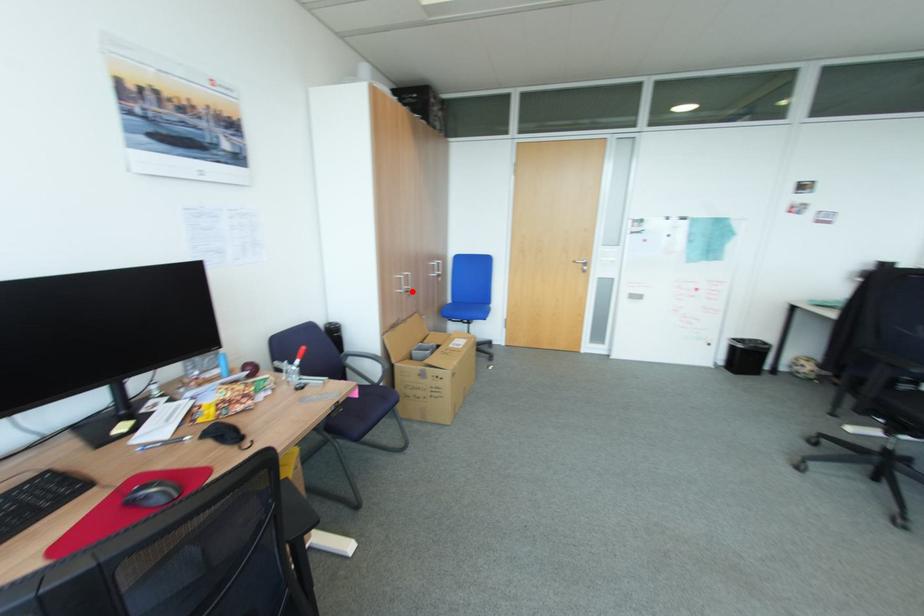
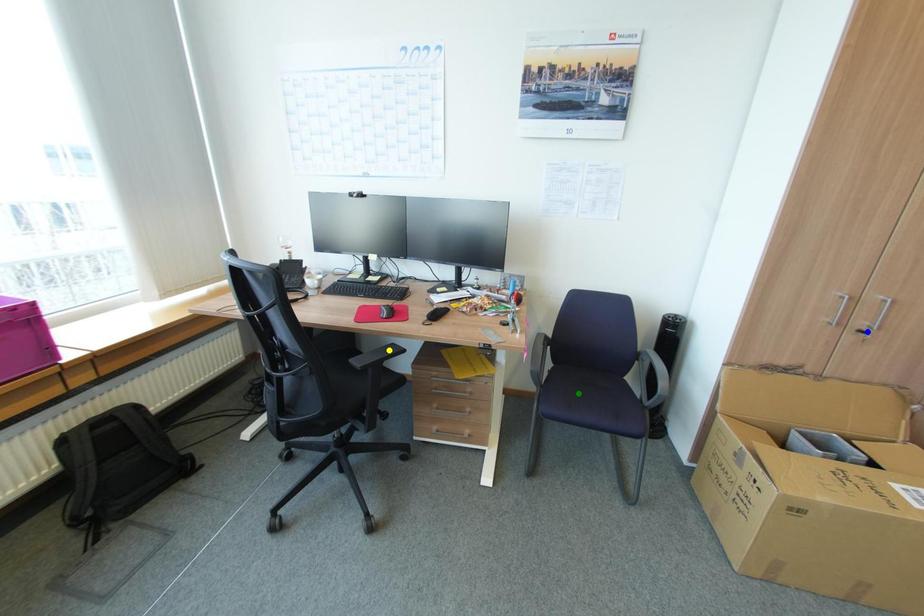
Question: I am providing you with two images of the same scene from different viewpoints. A red point is marked on the first image. You are given multiple points on the second image. Which point in image 2 represents the same 3d spot as the red point in image 1?

Choices:
 (A) blue point
 (B) yellow point
 (C) green point

Answer: (A)